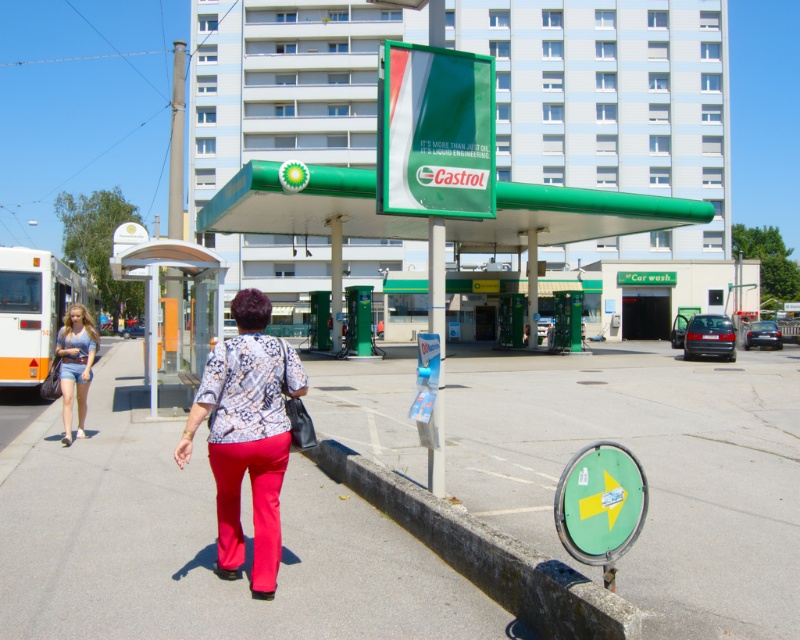
Consider the image. Who is more distant from viewer, (170, 378) or (218, 560)?

The point (170, 378) is behind.

Who is more forward, (x=189, y=349) or (x=276, y=513)?

Point (x=276, y=513) is more forward.

Image resolution: width=800 pixels, height=640 pixels. What do you see at coordinates (176, 314) in the screenshot? I see `white metallic bus stop at left` at bounding box center [176, 314].

You are a GUI agent. You are given a task and a screenshot of the screen. Output one action in this format:
    pyautogui.click(x=<x>, y=<y>)
    Task: Click on the white metallic bus stop at left
    
    Given the screenshot: What is the action you would take?
    pyautogui.click(x=176, y=314)

Who is more forward, [166,364] or [93,296]?

Point [166,364]

Find the location of a particular element. white metallic bus stop at left is located at coordinates (176, 314).

Find the location of a particular element. white metallic bus stop at left is located at coordinates pos(176,314).

Can you confirm if matte red pants at center is bigger than denim shorts at left?

Incorrect, matte red pants at center is not larger than denim shorts at left.

Is matte red pants at center taller than denim shorts at left?

In fact, matte red pants at center may be shorter than denim shorts at left.

Where is `matte red pants at center`? matte red pants at center is located at coordinates (252, 502).